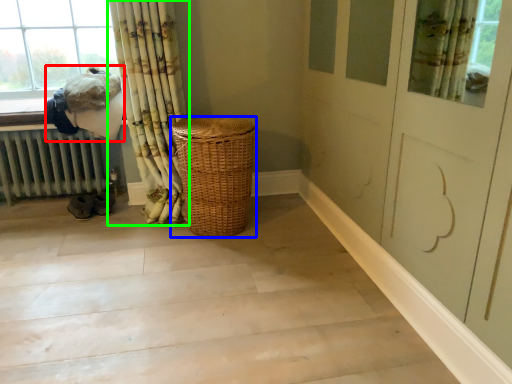
Question: Based on their relative distances, which object is farther from laundry (highlighted by a red box)? Choose from basket (highlighted by a blue box) and curtain (highlighted by a green box).

Choices:
 (A) basket
 (B) curtain

Answer: (A)